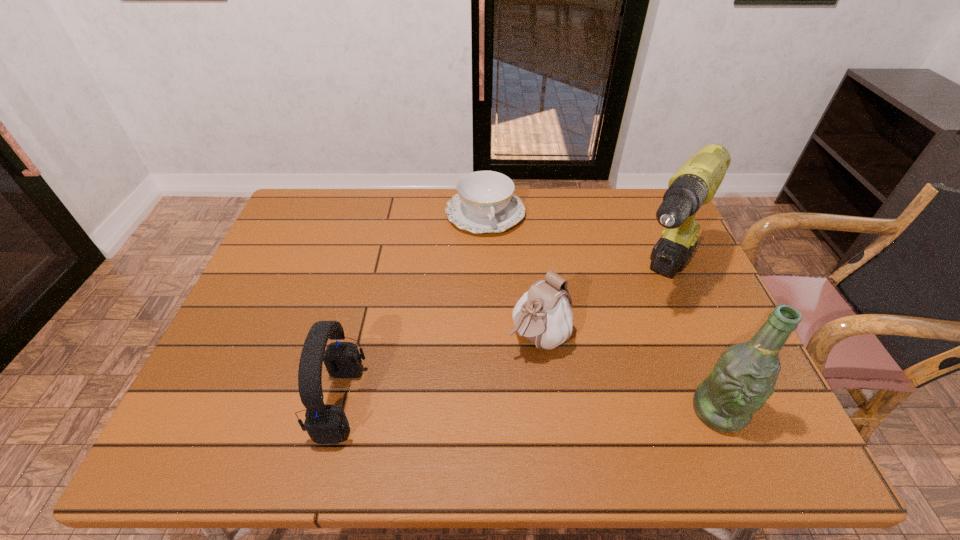
What are the coordinates of `vacant space that's between the farthest object and the pouch` in the screenshot? It's located at (512, 275).

Where is `free space between the drill and the headset`? The height and width of the screenshot is (540, 960). free space between the drill and the headset is located at coordinates (500, 340).

I want to click on free space between the leftmost object and the beer bottle, so click(529, 406).

Locate an element on the screen. This screenshot has width=960, height=540. free space between the beer bottle and the headset is located at coordinates (529, 406).

Identify the location of empty space between the drill and the beer bottle. Image resolution: width=960 pixels, height=540 pixels. (689, 345).

Where is `free space between the leftmost object and the drill`? This screenshot has width=960, height=540. free space between the leftmost object and the drill is located at coordinates (500, 340).

The width and height of the screenshot is (960, 540). Find the location of `free space between the shortest object and the pouch`. free space between the shortest object and the pouch is located at coordinates (512, 275).

Where is `free space between the beer bottle and the chinaware`? free space between the beer bottle and the chinaware is located at coordinates (602, 312).

You are a GUI agent. You are given a task and a screenshot of the screen. Output one action in this format:
    pyautogui.click(x=<x>, y=<y>)
    Task: Click on the vacant region between the shortest object and the beer bottle
    
    Given the screenshot: What is the action you would take?
    pyautogui.click(x=602, y=312)

Select which object appears as the second closest to the drill. Please provide its 2D coordinates. Your answer should be formatted as a tuple, i.e. [(x, y)], where the tuple contains the x and y coordinates of a point satisfying the conditions above.

[(744, 377)]